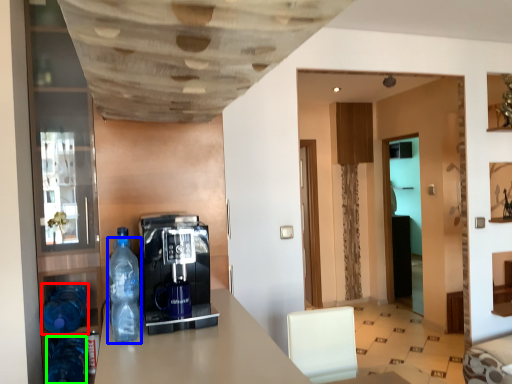
Question: Which object is the farthest from bottle (highlighted by a red box)? Choose among these: bottle (highlighted by a blue box) or bottle (highlighted by a green box).

Choices:
 (A) bottle
 (B) bottle

Answer: (A)